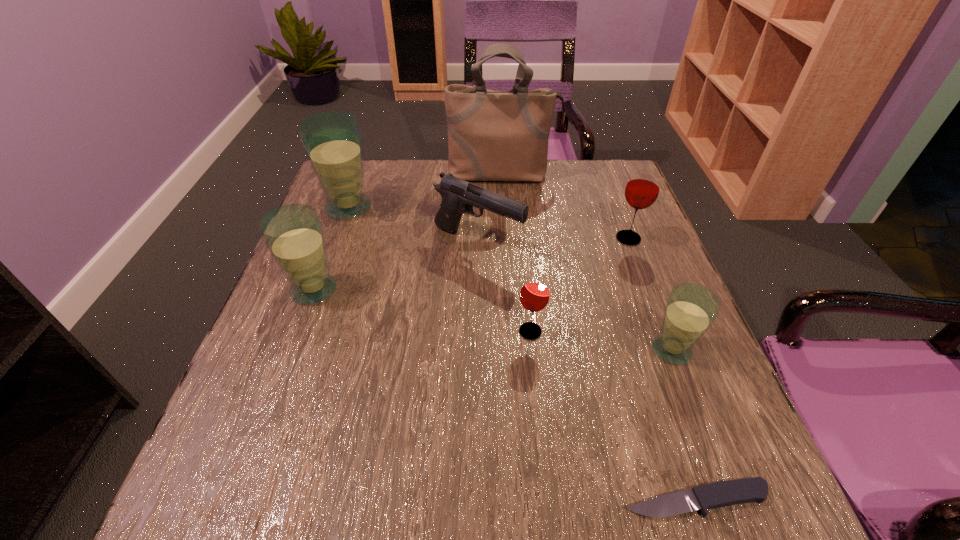
At what (x,y) coordinates should I click in order to perform the action: click on vacant area that lies between the shoulder bag and the second nearest blue glass. Please return your answer as a coordinate pair (x, y). Looking at the image, I should click on (408, 232).

Locate an element on the screen. vacant space that's between the bigger red glass and the gun is located at coordinates (553, 241).

At what (x,y) coordinates should I click in order to perform the action: click on free space between the steak knife and the nearest blue glass. Please return your answer as a coordinate pair (x, y). Looking at the image, I should click on (684, 426).

Image resolution: width=960 pixels, height=540 pixels. I want to click on vacant region between the tan shoulder bag and the nearest object, so click(x=599, y=338).

You are a GUI agent. You are given a task and a screenshot of the screen. Output one action in this format:
    pyautogui.click(x=<x>, y=<y>)
    Task: Click on the free spot between the steak knife and the black gun
    The width and height of the screenshot is (960, 540).
    Given the screenshot: What is the action you would take?
    pyautogui.click(x=587, y=372)

Find the location of a particular element. This screenshot has width=960, height=540. the sixth closest object relative to the right red glass is located at coordinates (332, 140).

Locate which object ranks fifth in proximity to the black gun. Please provide its 2D coordinates. Your answer should be formatted as a tuple, i.e. [(x, y)], where the tuple contains the x and y coordinates of a point satisfying the conditions above.

[(642, 189)]

What are the coordinates of `the second closest glass relative to the shoulder bag` in the screenshot? It's located at (642, 189).

Where is `glass that is the fourth closest to the smallest blue glass`? Image resolution: width=960 pixels, height=540 pixels. glass that is the fourth closest to the smallest blue glass is located at coordinates (332, 140).

Locate which blue glass is the closest to the smallest blue glass. Please provide its 2D coordinates. Your answer should be formatted as a tuple, i.e. [(x, y)], where the tuple contains the x and y coordinates of a point satisfying the conditions above.

[(293, 233)]